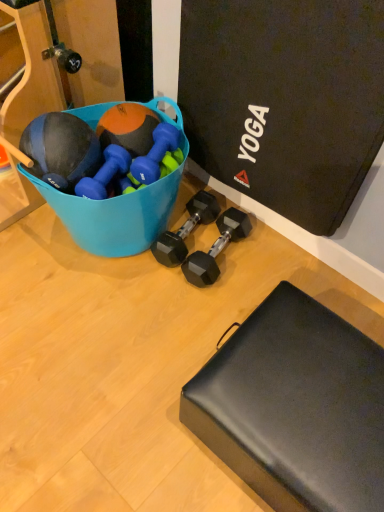
Find the location of a particular element. Image resolution: width=384 pixels, height=512 pixels. unoccupied area in front of blue plastic bucket at upper left is located at coordinates (116, 324).